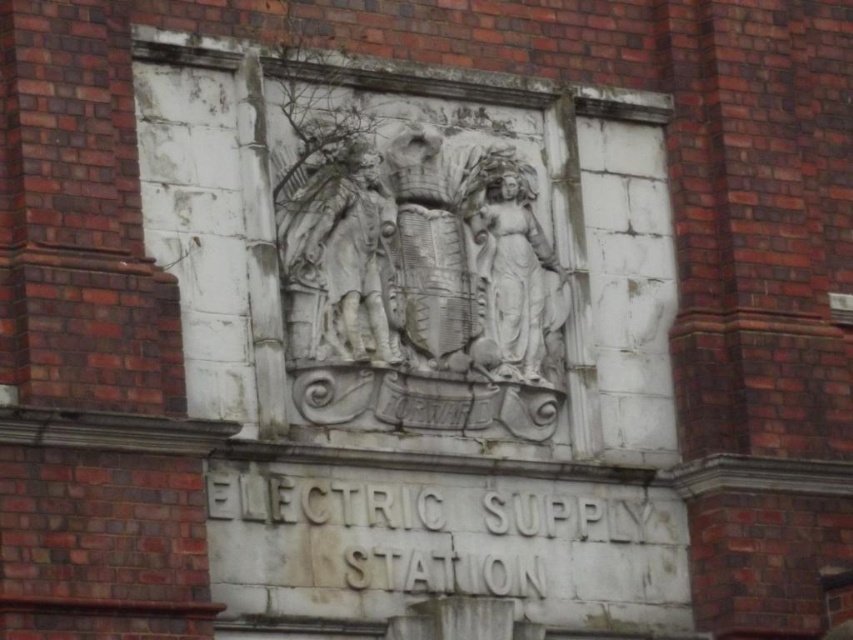
You are an art conservator assessing the brick building. You notice both the white stone relief at center and the white stone statue at center. Which one has a larger size?

The white stone relief at center is bigger than the white stone statue at center.

You are an architect examining the brick building. You notice the white stone relief at center and the white stone statue at center. Which one is positioned lower on the wall?

The white stone relief at center is positioned lower on the wall because it is below the white stone statue at center.

You are an architect examining the brick building. You need to determine which object is taller between the white stone relief at center and the white stone statue at center. Based on the scene, which one is taller?

The white stone relief at center is taller than the white stone statue at center according to the description.